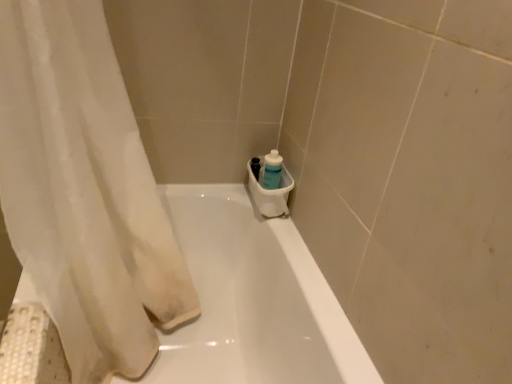
Where is `vacant position to the left of translucent plastic bottle at lower right`? Image resolution: width=512 pixels, height=384 pixels. vacant position to the left of translucent plastic bottle at lower right is located at coordinates (226, 201).